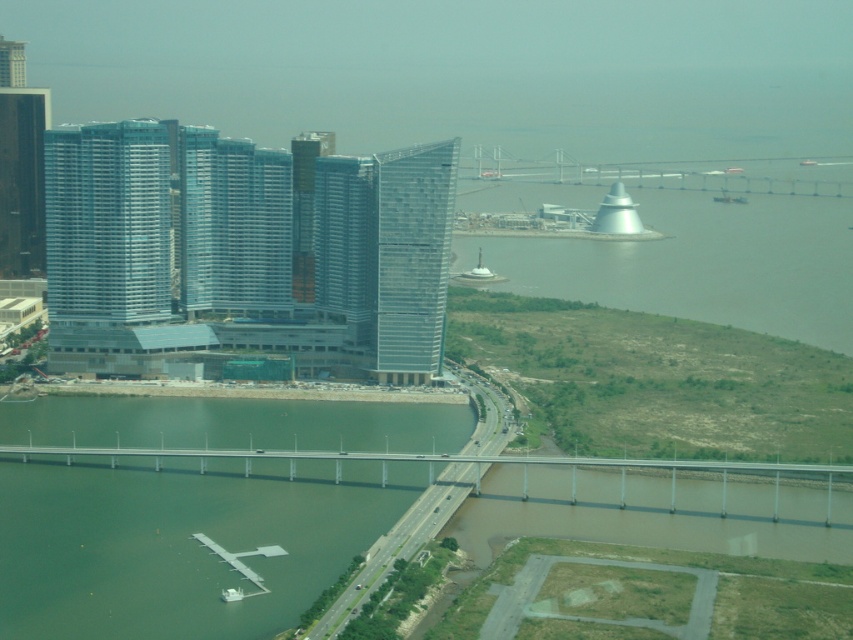
Question: Can you confirm if transparent glass skyscraper at center is smaller than dark glass skyscraper at left?

Choices:
 (A) no
 (B) yes

Answer: (A)

Question: Considering the relative positions of white metallic bridge at upper center and dark glass skyscraper at left in the image provided, where is white metallic bridge at upper center located with respect to dark glass skyscraper at left?

Choices:
 (A) left
 (B) right

Answer: (B)

Question: Which point appears farthest from the camera in this image?

Choices:
 (A) (192, 634)
 (B) (321, 452)

Answer: (B)

Question: Among these points, which one is farthest from the camera?

Choices:
 (A) (1, 88)
 (B) (368, 280)
 (C) (462, 170)

Answer: (A)

Question: Which object is the farthest from the green concrete bridge at lower left?

Choices:
 (A) transparent glass skyscraper at center
 (B) dark glass skyscraper at left
 (C) glassy blue skyscraper at center-left

Answer: (B)

Question: Is green concrete bridge at lower left further to the viewer compared to transparent glass skyscraper at center?

Choices:
 (A) yes
 (B) no

Answer: (B)